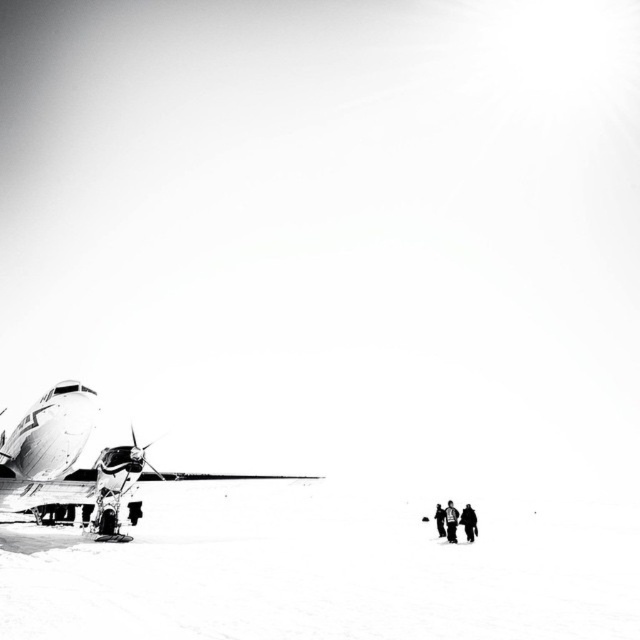
Is dark gray jacket at lower right wider than black fabric jacket at lower right?

Correct, the width of dark gray jacket at lower right exceeds that of black fabric jacket at lower right.

Who is more forward, (476, 531) or (440, 502)?

Point (476, 531) is in front.

You are a GUI agent. You are given a task and a screenshot of the screen. Output one action in this format:
    pyautogui.click(x=<x>, y=<y>)
    Task: Click on the dark gray jacket at lower right
    The height and width of the screenshot is (640, 640).
    Given the screenshot: What is the action you would take?
    pyautogui.click(x=468, y=522)

Does dark gray jacket at lower right have a greater width compared to snowboarder at lower right?

Yes.

What do you see at coordinates (468, 522) in the screenshot? I see `dark gray jacket at lower right` at bounding box center [468, 522].

Find the location of `dark gray jacket at lower right`. dark gray jacket at lower right is located at coordinates (x=468, y=522).

Does metallic airplane at left have a larger size compared to dark gray jacket at lower right?

Yes.

Who is more distant from viewer, (76,413) or (464,529)?

Point (464,529)

Locate an element on the screen. The image size is (640, 640). metallic airplane at left is located at coordinates (80, 467).